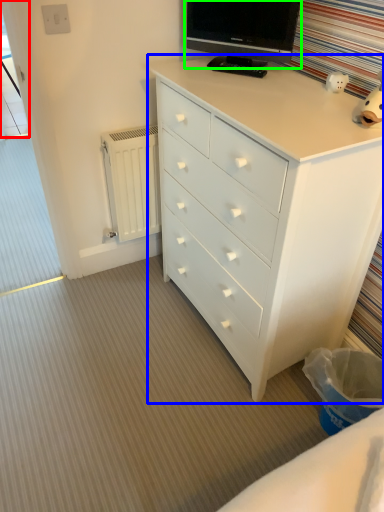
Question: Considering the real-world distances, which object is closest to screen door (highlighted by a red box)? chest of drawers (highlighted by a blue box) or television (highlighted by a green box).

Choices:
 (A) chest of drawers
 (B) television

Answer: (B)